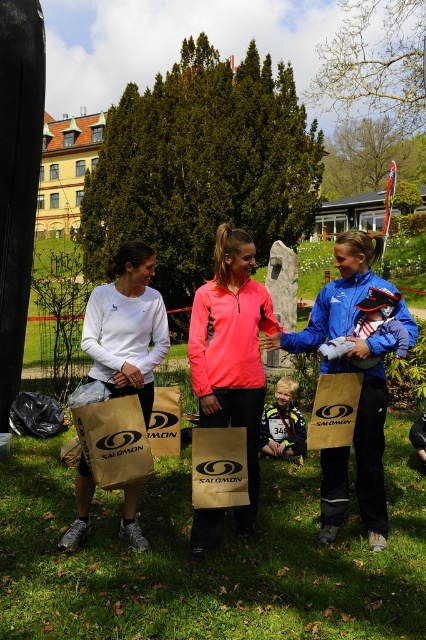
Question: Is neon pink zip-up jacket at center closer to camera compared to yellow-green jersey at center?

Choices:
 (A) yes
 (B) no

Answer: (A)

Question: Which is farther from the yellow-green jersey at center?

Choices:
 (A) neon pink zip-up jacket at center
 (B) brown paper bag at center

Answer: (B)

Question: Does neon pink zip-up jacket at center have a lesser width compared to brown paper bag at center?

Choices:
 (A) yes
 (B) no

Answer: (B)

Question: Which of the following is the closest to the observer?

Choices:
 (A) (131, 369)
 (B) (242, 268)

Answer: (A)

Question: Is green grass at center to the left of brown paper bag at center from the viewer's perspective?

Choices:
 (A) no
 (B) yes

Answer: (A)

Question: Estimate the real-world distances between objects in this image. Which object is closer to the matte brown paper bag at center?

Choices:
 (A) brown paper bag at center
 (B) white matte bag at left
 (C) neon pink zip-up jacket at center
 (D) green grass at center

Answer: (C)